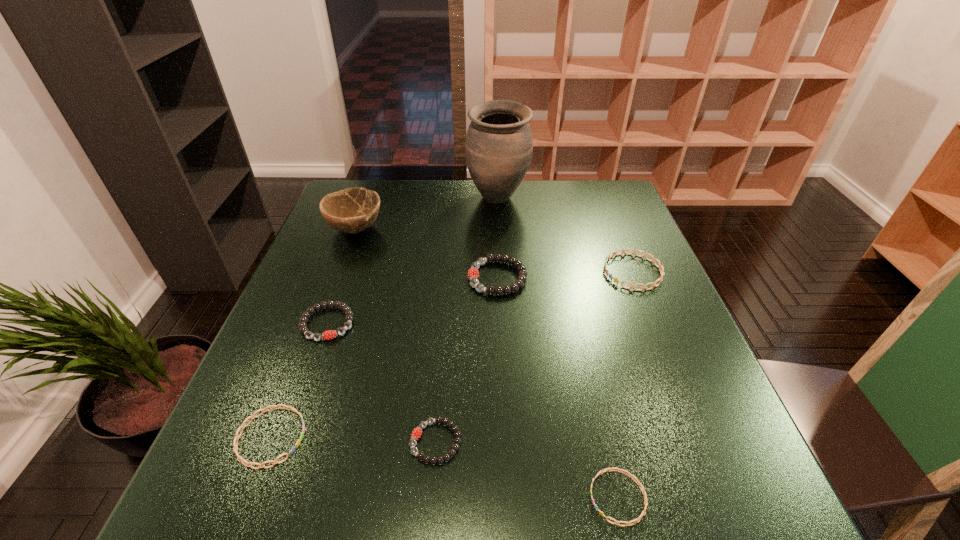
What are the coordinates of `the nearest black bracelet` in the screenshot? It's located at (417, 432).

Where is `the shortest bracelet`? the shortest bracelet is located at coordinates (640, 517).

The width and height of the screenshot is (960, 540). I want to click on the smallest blue bracelet, so click(640, 517).

This screenshot has height=540, width=960. I want to click on vacant space located on the right of the urn, so click(x=598, y=198).

You are a GUI agent. You are given a task and a screenshot of the screen. Output one action in this format:
    pyautogui.click(x=<x>, y=<y>)
    Task: Click on the vacant region located 0.060m on the back of the bowl
    This screenshot has width=960, height=540.
    Given the screenshot: What is the action you would take?
    pyautogui.click(x=365, y=203)

Where is `vacant space located on the left of the third tallest object`? The height and width of the screenshot is (540, 960). vacant space located on the left of the third tallest object is located at coordinates (317, 278).

At what (x,y) coordinates should I click in order to perform the action: click on free location located on the surface of the rightmost blue bracelet showing star-shaped elements. Please return your answer as a coordinate pair (x, y). The image size is (960, 540). Looking at the image, I should click on (471, 272).

You are a GUI agent. You are given a task and a screenshot of the screen. Output one action in this format:
    pyautogui.click(x=<x>, y=<y>)
    Task: Click on the vacant space located on the surface of the rightmost blue bracelet showing star-shaped elements
    
    Given the screenshot: What is the action you would take?
    pyautogui.click(x=494, y=272)

You are a GUI agent. You are given a task and a screenshot of the screen. Output one action in this format:
    pyautogui.click(x=<x>, y=<y>)
    Task: Click on the vacant area situated on the surface of the rightmost blue bracelet showing star-shaped elements
    The width and height of the screenshot is (960, 540).
    Given the screenshot: What is the action you would take?
    pyautogui.click(x=468, y=272)

Where is `free space located on the back of the second smallest black bracelet`? This screenshot has height=540, width=960. free space located on the back of the second smallest black bracelet is located at coordinates pos(350,260).